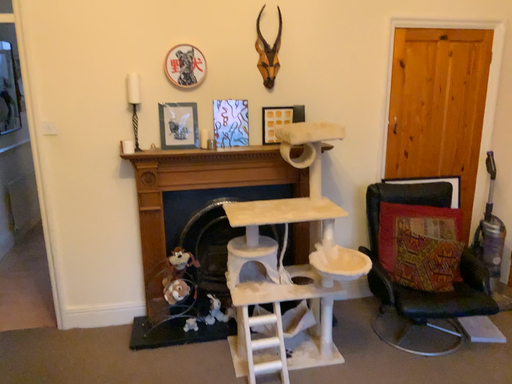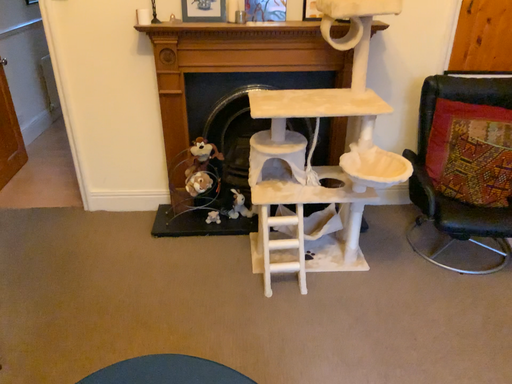
Question: How did the camera likely rotate when shooting the video?

Choices:
 (A) rotated downward
 (B) rotated upward

Answer: (A)